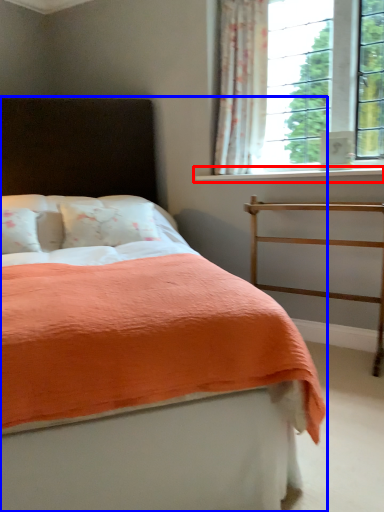
Question: Which point is closer to the camera, window sill (highlighted by a red box) or bed (highlighted by a blue box)?

Choices:
 (A) window sill
 (B) bed

Answer: (B)